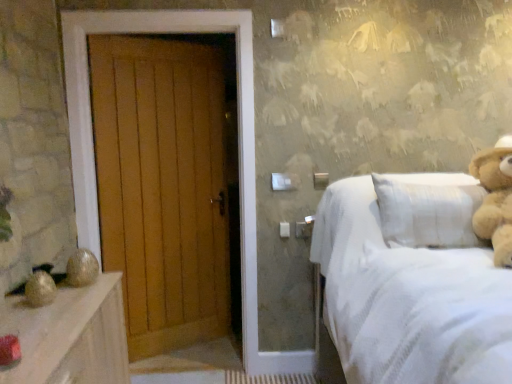
Question: Can you confirm if light brown plush teddy bear at right is positioned to the right of wooden door at left?

Choices:
 (A) yes
 (B) no

Answer: (A)

Question: Considering the relative sizes of light brown plush teddy bear at right and wooden door at left in the image provided, is light brown plush teddy bear at right wider than wooden door at left?

Choices:
 (A) no
 (B) yes

Answer: (B)

Question: From the image's perspective, is light brown plush teddy bear at right over wooden door at left?

Choices:
 (A) yes
 (B) no

Answer: (A)

Question: Considering the relative sizes of light brown plush teddy bear at right and wooden door at left in the image provided, is light brown plush teddy bear at right smaller than wooden door at left?

Choices:
 (A) no
 (B) yes

Answer: (B)

Question: Is light brown plush teddy bear at right far from wooden door at left?

Choices:
 (A) yes
 (B) no

Answer: (A)

Question: From a real-world perspective, is light brown plush teddy bear at right located higher than wooden door at left?

Choices:
 (A) yes
 (B) no

Answer: (A)

Question: Is the depth of wooden door at left less than that of light brown plush teddy bear at right?

Choices:
 (A) yes
 (B) no

Answer: (B)

Question: Does wooden door at left have a smaller size compared to light brown plush teddy bear at right?

Choices:
 (A) no
 (B) yes

Answer: (A)

Question: Does wooden door at left appear on the left side of light brown plush teddy bear at right?

Choices:
 (A) no
 (B) yes

Answer: (B)

Question: Is wooden door at left taller than light brown plush teddy bear at right?

Choices:
 (A) no
 (B) yes

Answer: (B)

Question: Considering the relative sizes of wooden door at left and light brown plush teddy bear at right in the image provided, is wooden door at left shorter than light brown plush teddy bear at right?

Choices:
 (A) yes
 (B) no

Answer: (B)

Question: Is light brown plush teddy bear at right at the back of wooden door at left?

Choices:
 (A) no
 (B) yes

Answer: (A)

Question: Is light brown plush teddy bear at right oriented away from white textured bed at right?

Choices:
 (A) no
 (B) yes

Answer: (B)